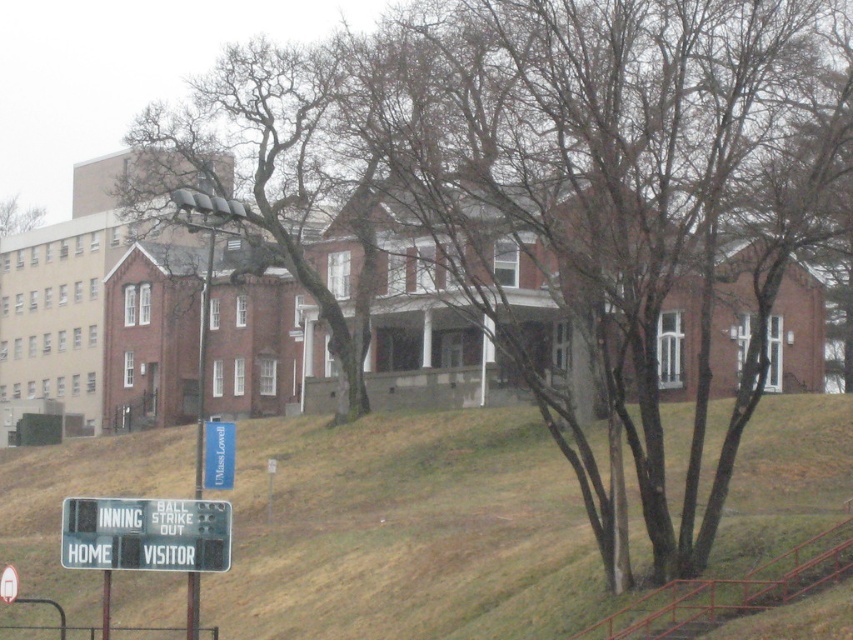
Locate an element on the screen. This screenshot has width=853, height=640. white plastic scoreboard at lower left is located at coordinates (144, 532).

Which is below, white plastic scoreboard at lower left or blue fabric sign at lower left?

white plastic scoreboard at lower left is below.

Image resolution: width=853 pixels, height=640 pixels. What do you see at coordinates (144, 532) in the screenshot?
I see `white plastic scoreboard at lower left` at bounding box center [144, 532].

This screenshot has height=640, width=853. Identify the location of white plastic scoreboard at lower left. (144, 532).

Can you confirm if green grass at lower center is taller than blue fabric sign at lower left?

Indeed, green grass at lower center has a greater height compared to blue fabric sign at lower left.

Is green grass at lower center bigger than blue fabric sign at lower left?

Yes.

Is point (119, 483) more distant than point (233, 452)?

Yes, it is.

Where is `green grass at lower center`? The height and width of the screenshot is (640, 853). green grass at lower center is located at coordinates (407, 532).

Is green grass at lower center bigger than white plastic scoreboard at lower left?

Correct, green grass at lower center is larger in size than white plastic scoreboard at lower left.

Based on the photo, which is above, green grass at lower center or white plastic scoreboard at lower left?

Positioned higher is white plastic scoreboard at lower left.

Where is `green grass at lower center`? The width and height of the screenshot is (853, 640). green grass at lower center is located at coordinates (407, 532).

What are the coordinates of `green grass at lower center` in the screenshot? It's located at (407, 532).